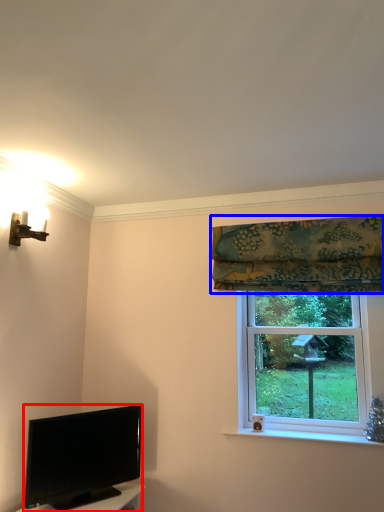
Question: Among these objects, which one is farthest to the camera, television (highlighted by a red box) or curtain (highlighted by a blue box)?

Choices:
 (A) television
 (B) curtain

Answer: (B)